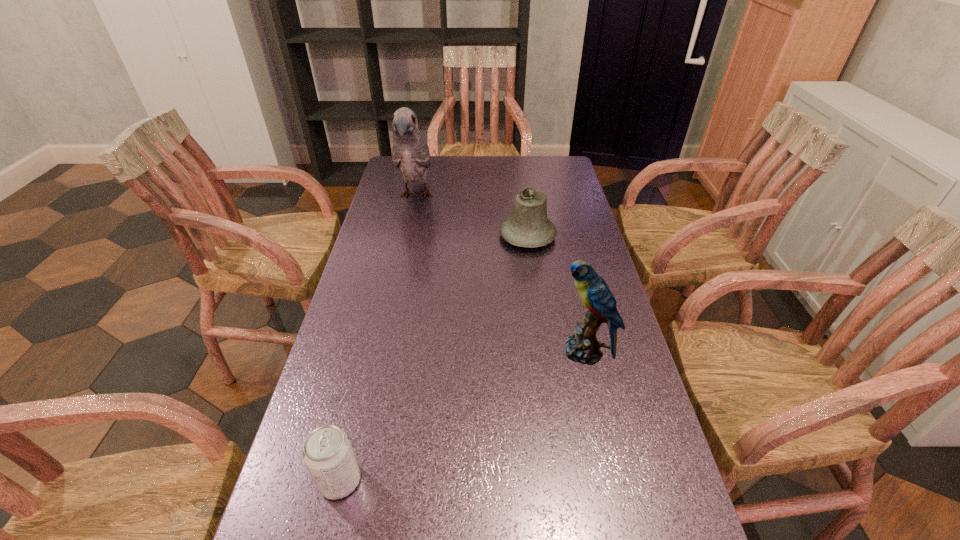
The width and height of the screenshot is (960, 540). Identify the location of vacant space that's between the right parrot and the second shortest object. (556, 294).

Locate an element on the screen. object that is the second closest one to the shorter parrot is located at coordinates (327, 453).

Locate an element on the screen. The height and width of the screenshot is (540, 960). object that is the third closest to the bell is located at coordinates (327, 453).

What are the coordinates of `blank area in the image that satisfies the following two spatial constraints: 1. on the front-facing side of the second shortest object; 2. on the right side of the farthest object` in the screenshot? It's located at (407, 236).